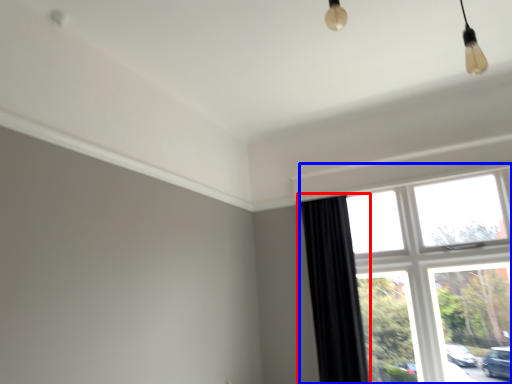
Question: Which object is further to the camera taking this photo, curtain (highlighted by a red box) or window (highlighted by a blue box)?

Choices:
 (A) curtain
 (B) window

Answer: (A)